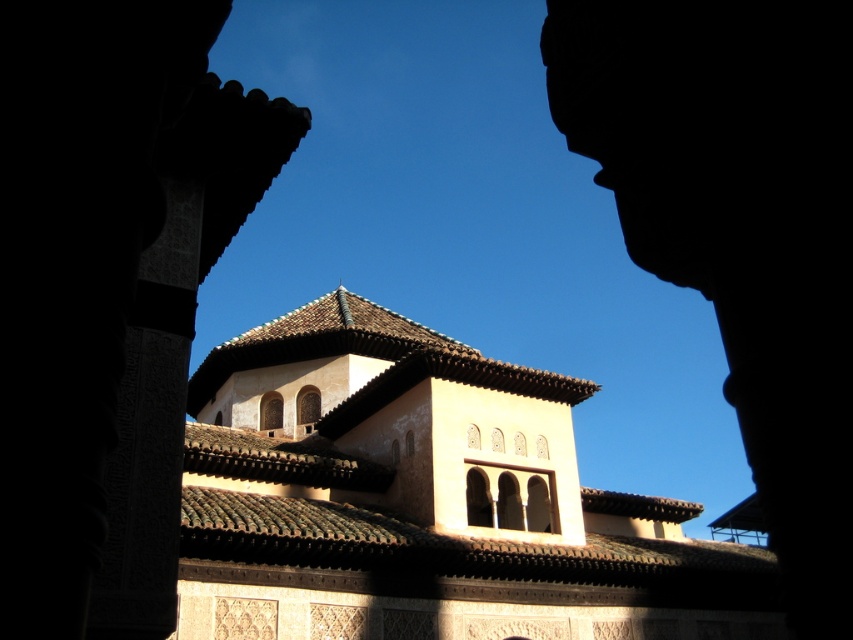
This screenshot has height=640, width=853. What do you see at coordinates (425, 499) in the screenshot? I see `beige stucco church at center` at bounding box center [425, 499].

Between beige stucco church at center and dark stone arch at center, which one is positioned lower?

beige stucco church at center is below.

Is point (515, 516) less distant than point (750, 285)?

No, it is behind (750, 285).

The image size is (853, 640). What are the coordinates of `beige stucco church at center` in the screenshot? It's located at (425, 499).